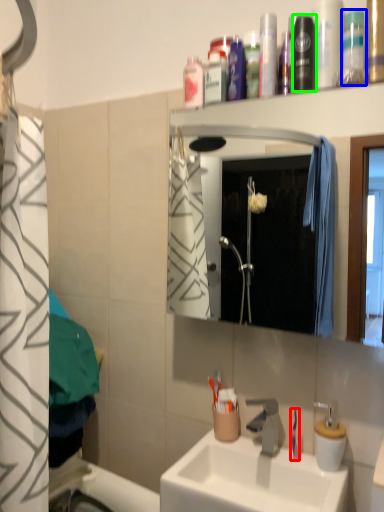
Question: Which is nearer to the toothbrush (highlighted by a red box)? mouthwash (highlighted by a blue box) or mouthwash (highlighted by a green box).

Choices:
 (A) mouthwash
 (B) mouthwash

Answer: (B)